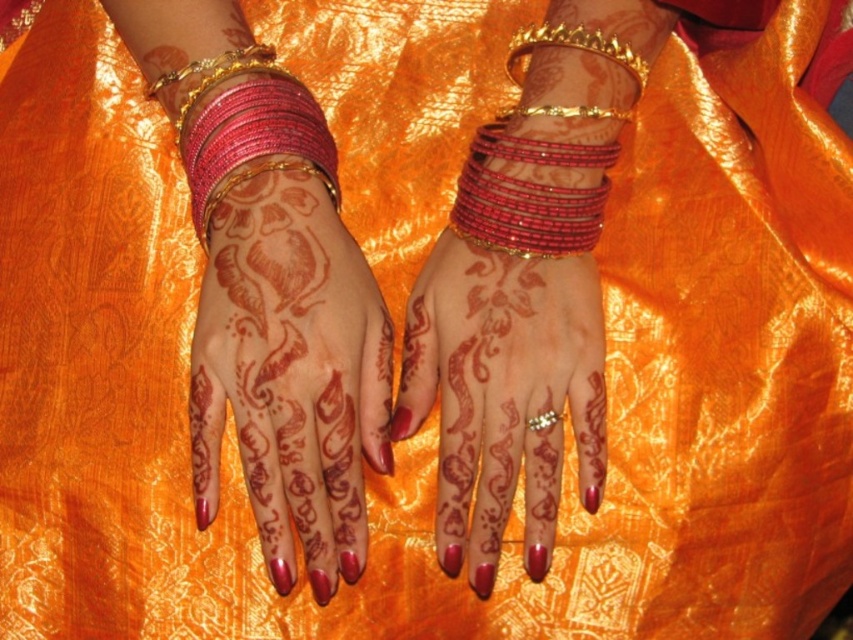
Is point (595, 218) less distant than point (604, 112)?

No, (595, 218) is behind (604, 112).

Which is in front, point (595, 145) or point (572, 113)?

Point (572, 113) is in front.

Where is `shiny red beaded bangles at center`? shiny red beaded bangles at center is located at coordinates (529, 196).

Can you confirm if brown matte henna at center is smaller than shiny pink beaded bangles at left?

No.

Which is above, brown matte henna at center or shiny pink beaded bangles at left?

shiny pink beaded bangles at left is above.

Where is `brown matte henna at center`? This screenshot has height=640, width=853. brown matte henna at center is located at coordinates (503, 394).

You are a GUI agent. You are given a task and a screenshot of the screen. Output one action in this format:
    pyautogui.click(x=<x>, y=<y>)
    Task: Click on the brown matte henna at center
    Image resolution: width=853 pixels, height=640 pixels.
    Given the screenshot: What is the action you would take?
    pyautogui.click(x=503, y=394)

Who is higher up, shiny pink beaded bangles at left or gold metallic bracelet at upper center?

gold metallic bracelet at upper center is above.

Does point (196, 172) come behind point (582, 115)?

No, it is in front of (582, 115).

Between point (287, 86) and point (509, 115), which one is positioned behind?

Positioned behind is point (509, 115).

You are a GUI agent. You are given a task and a screenshot of the screen. Output one action in this format:
    pyautogui.click(x=<x>, y=<y>)
    Task: Click on the shiny pink beaded bangles at left
    
    Given the screenshot: What is the action you would take?
    pyautogui.click(x=253, y=136)